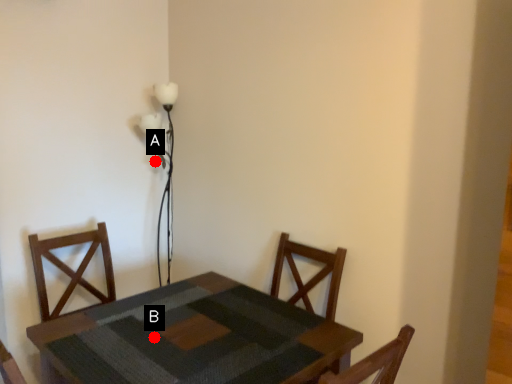
Question: Two points are circled on the image, labeled by A and B beside each circle. Which point is farther from the camera taking this photo?

Choices:
 (A) A is further
 (B) B is further

Answer: (A)